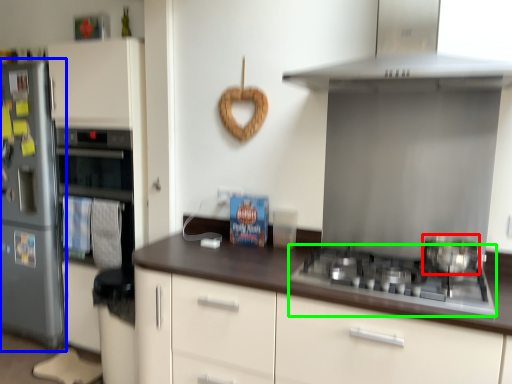
Question: Which object is positioned farthest from kitchen appliance (highlighted by a red box)? Select from refrigerator (highlighted by a blue box) and gas stove (highlighted by a green box).

Choices:
 (A) refrigerator
 (B) gas stove

Answer: (A)